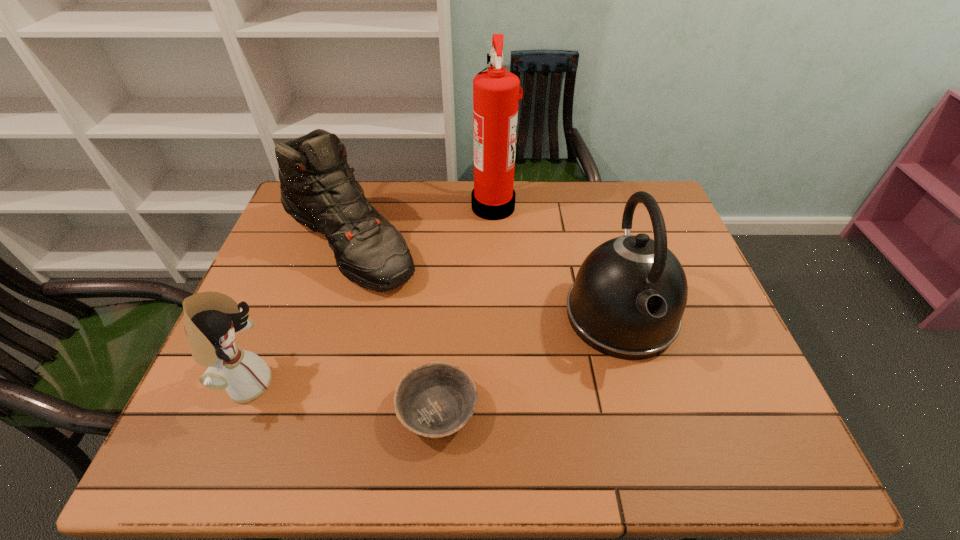
The width and height of the screenshot is (960, 540). Identify the location of empty location between the ski boot and the fire extinguisher. (420, 225).

Find the location of a particular element. This screenshot has width=960, height=540. free space that is in between the shortest object and the fourth tallest object is located at coordinates [342, 397].

Locate an element on the screen. This screenshot has height=540, width=960. free space between the ski boot and the doll is located at coordinates (297, 314).

The width and height of the screenshot is (960, 540). In order to click on free area in between the ski boot and the rightmost object in this screenshot , I will do `click(484, 280)`.

The width and height of the screenshot is (960, 540). In order to click on object identified as the closest to the ski boot in this screenshot , I will do `click(496, 96)`.

Identify the location of the second closest object to the rightmost object. (434, 400).

Where is `vacant region that satisfies the following two spatial constraints: 1. at the front face of the bowl; 2. on the right side of the doll`? This screenshot has width=960, height=540. vacant region that satisfies the following two spatial constraints: 1. at the front face of the bowl; 2. on the right side of the doll is located at coordinates 235,411.

This screenshot has height=540, width=960. Find the location of `free location that satisfies the following two spatial constraints: 1. on the spout of the kettle; 2. at the front face of the second shortest object`. free location that satisfies the following two spatial constraints: 1. on the spout of the kettle; 2. at the front face of the second shortest object is located at coordinates (640, 384).

Identify the location of free point that satisfies the following two spatial constraints: 1. on the front side of the ski boot; 2. at the front face of the second shortest object. The image size is (960, 540). (304, 384).

Identify the location of free location that satisfies the following two spatial constraints: 1. on the front side of the ski boot; 2. at the front face of the doll. The width and height of the screenshot is (960, 540). (304, 384).